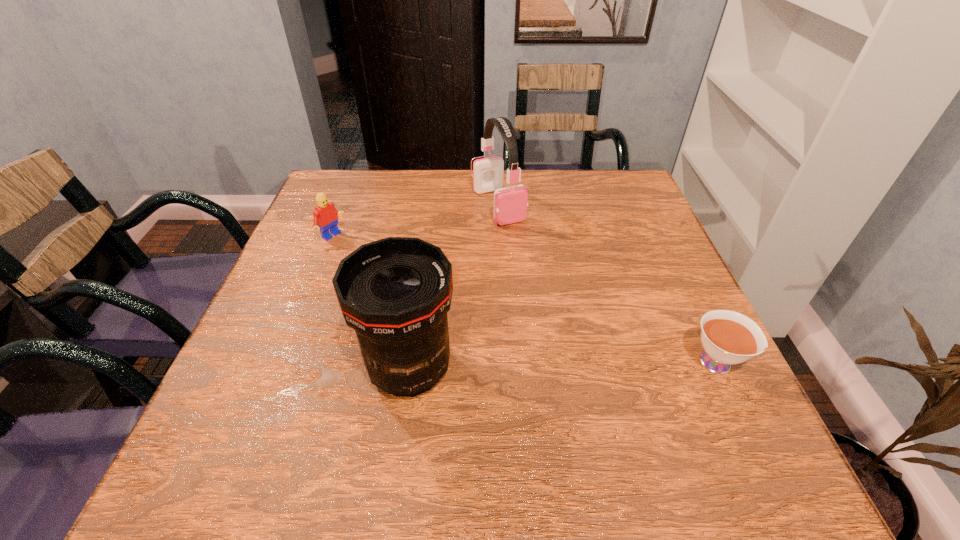
The height and width of the screenshot is (540, 960). I want to click on the second object from left to right, so click(395, 293).

At what (x,y) coordinates should I click in order to perform the action: click on the shortest object. Please return your answer as a coordinate pair (x, y). The image size is (960, 540). Looking at the image, I should click on (728, 337).

Find the location of a particular element. the rightmost object is located at coordinates (728, 337).

Locate an element on the screen. This screenshot has width=960, height=540. the third tallest object is located at coordinates (325, 215).

You are a GUI agent. You are given a task and a screenshot of the screen. Output one action in this format:
    pyautogui.click(x=<x>, y=<y>)
    Task: Click on the leftmost object
    The height and width of the screenshot is (540, 960).
    Given the screenshot: What is the action you would take?
    pyautogui.click(x=325, y=215)

Locate an element on the screen. This screenshot has width=960, height=540. the third object from left to right is located at coordinates coord(510,203).

Where is `earphone`? earphone is located at coordinates (510, 203).

The image size is (960, 540). Identify the location of vacant space located 0.210m on the back of the telephoto lens. 424,264.

Where is `vacant position located 0.370m on the front-facing side of the leftmost object`? This screenshot has width=960, height=540. vacant position located 0.370m on the front-facing side of the leftmost object is located at coordinates (454, 314).

Image resolution: width=960 pixels, height=540 pixels. In order to click on free space located 0.370m on the front-facing side of the leftmost object in this screenshot , I will do `click(454, 314)`.